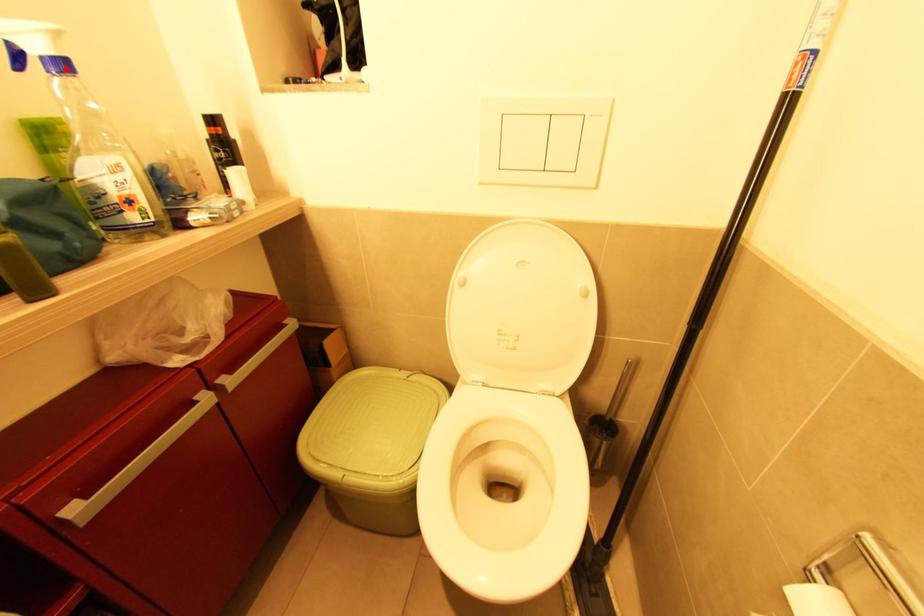
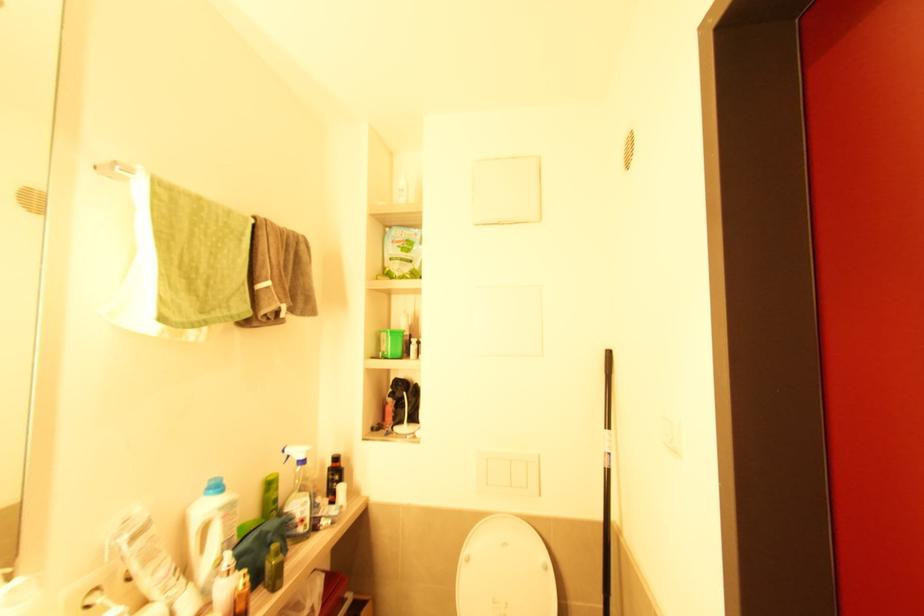
Locate, in the second image, the point that corresponds to the highlighted location in the first image.

(305, 462)